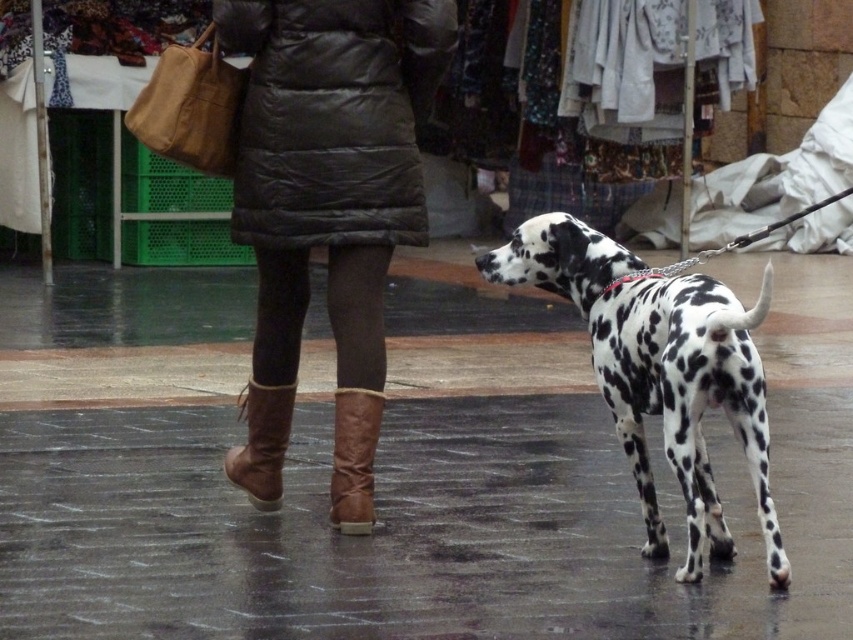
Based on the photo, you are standing at the center of the image and need to locate the leather boots at center. According to the coordinates provided, in which direction should you look to find them?

The leather boots at center are located at coordinates point 0.327 on the x axis and 0.385 on the y axis, so you should look slightly to the left and down from the very center of the image.